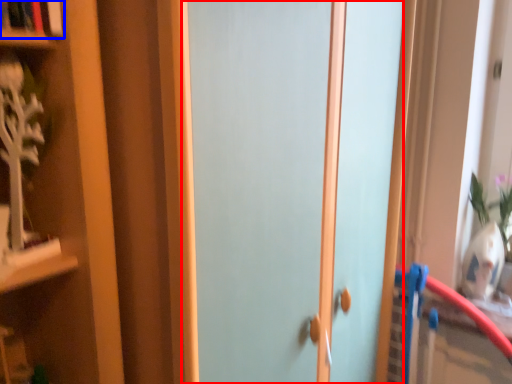
Question: Among these objects, which one is farthest to the camera, door (highlighted by a red box) or book (highlighted by a blue box)?

Choices:
 (A) door
 (B) book

Answer: (B)